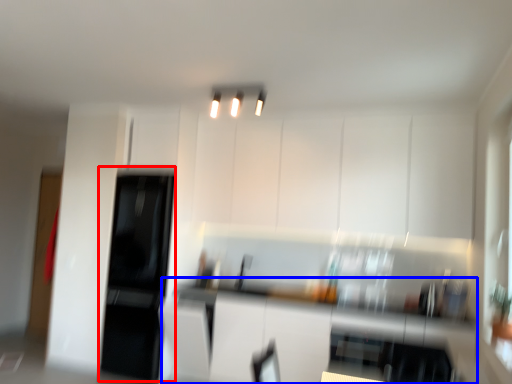
Question: Which point is further to the camera, appliance (highlighted by a red box) or counter top (highlighted by a blue box)?

Choices:
 (A) appliance
 (B) counter top

Answer: (A)